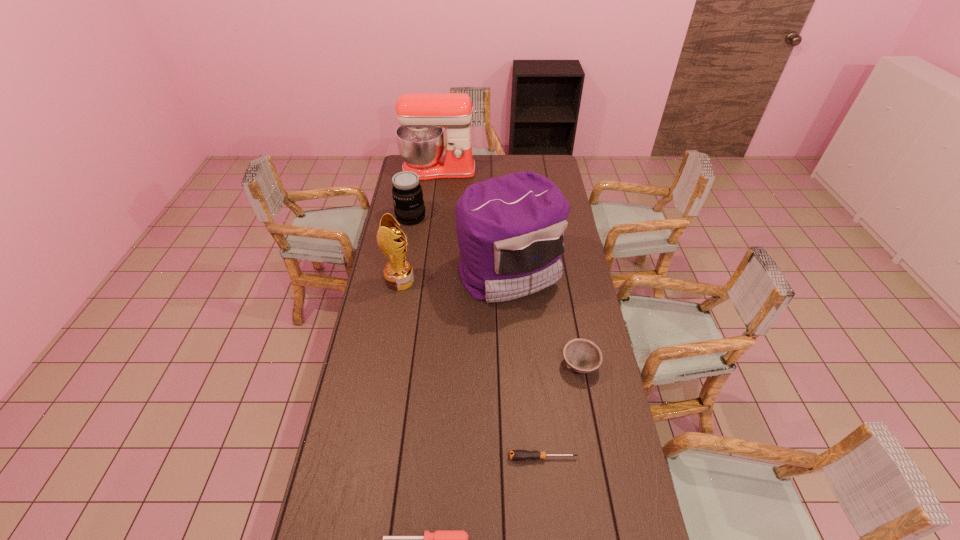
Where is `bowl at the right edge`? The image size is (960, 540). bowl at the right edge is located at coordinates (583, 356).

Locate an element on the screen. The width and height of the screenshot is (960, 540). screwdriver that is positioned at the right edge is located at coordinates 520,455.

Find the location of a particular element. This screenshot has height=540, width=960. object that is at the far left corner is located at coordinates (420, 138).

Image resolution: width=960 pixels, height=540 pixels. Find the location of `vacant space at the far edge of the desktop`. vacant space at the far edge of the desktop is located at coordinates pos(485,156).

Where is `free point at the left edge`? The width and height of the screenshot is (960, 540). free point at the left edge is located at coordinates (351, 471).

The width and height of the screenshot is (960, 540). I want to click on vacant space at the right edge, so click(575, 238).

Locate an element on the screen. This screenshot has height=540, width=960. unoccupied area between the fifth tallest object and the backpack is located at coordinates (544, 318).

Where is `vacant area between the backpack and the right screwdriver`? The width and height of the screenshot is (960, 540). vacant area between the backpack and the right screwdriver is located at coordinates (526, 364).

In order to click on object that is the fourth closest to the farthest object in this screenshot , I will do `click(583, 356)`.

Point out which object is positioned as the second nearest to the left screwdriver. Please provide its 2D coordinates. Your answer should be formatted as a tuple, i.e. [(x, y)], where the tuple contains the x and y coordinates of a point satisfying the conditions above.

[(583, 356)]